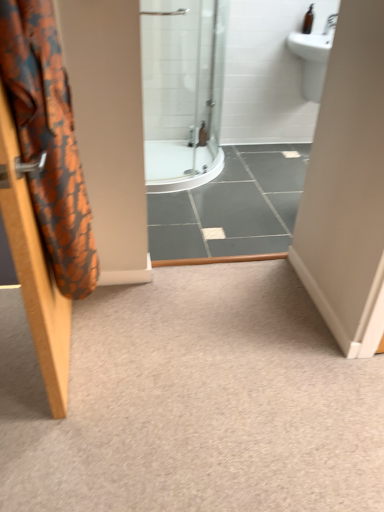
Question: Does brown glass bottle at upper right have a greater height compared to orange fabric shower curtain at left?

Choices:
 (A) yes
 (B) no

Answer: (B)

Question: Does brown glass bottle at upper right have a smaller size compared to orange fabric shower curtain at left?

Choices:
 (A) no
 (B) yes

Answer: (B)

Question: Can you confirm if brown glass bottle at upper right is bigger than orange fabric shower curtain at left?

Choices:
 (A) no
 (B) yes

Answer: (A)

Question: Considering the relative positions of brown glass bottle at upper right and orange fabric shower curtain at left in the image provided, is brown glass bottle at upper right to the left of orange fabric shower curtain at left from the viewer's perspective?

Choices:
 (A) yes
 (B) no

Answer: (B)

Question: Considering the relative sizes of brown glass bottle at upper right and orange fabric shower curtain at left in the image provided, is brown glass bottle at upper right shorter than orange fabric shower curtain at left?

Choices:
 (A) no
 (B) yes

Answer: (B)

Question: Is carpet at center wider or thinner than orange fabric shower curtain at left?

Choices:
 (A) wide
 (B) thin

Answer: (A)

Question: Based on their sizes in the image, would you say carpet at center is bigger or smaller than orange fabric shower curtain at left?

Choices:
 (A) small
 (B) big

Answer: (B)

Question: Does point (87, 496) appear closer or farther from the camera than point (34, 101)?

Choices:
 (A) closer
 (B) farther

Answer: (B)

Question: Choose the correct answer: Is carpet at center inside orange fabric shower curtain at left or outside it?

Choices:
 (A) outside
 (B) inside

Answer: (A)

Question: Considering their positions, is brown glass bottle at upper right located in front of or behind carpet at center?

Choices:
 (A) front
 (B) behind

Answer: (B)

Question: In terms of height, does brown glass bottle at upper right look taller or shorter compared to carpet at center?

Choices:
 (A) tall
 (B) short

Answer: (A)

Question: From a real-world perspective, is brown glass bottle at upper right positioned above or below carpet at center?

Choices:
 (A) above
 (B) below

Answer: (A)

Question: From the image's perspective, is brown glass bottle at upper right located above or below carpet at center?

Choices:
 (A) below
 (B) above

Answer: (B)

Question: From the image's perspective, relative to carpet at center, is orange fabric shower curtain at left above or below?

Choices:
 (A) below
 (B) above

Answer: (B)

Question: Would you say orange fabric shower curtain at left is to the left or to the right of carpet at center in the picture?

Choices:
 (A) left
 (B) right

Answer: (A)